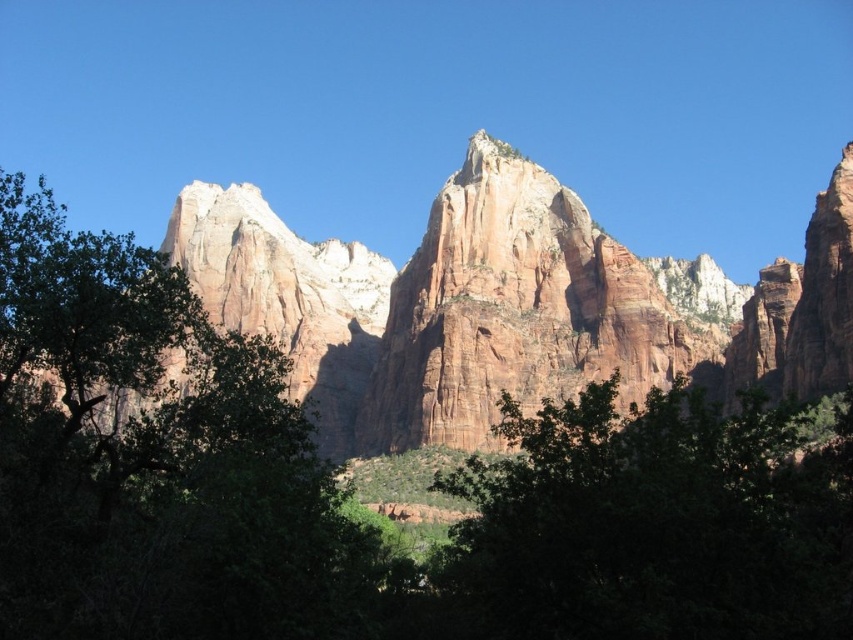
Does point (84, 413) lie behind point (520, 264)?

No, (84, 413) is closer to viewer.

The image size is (853, 640). Describe the element at coordinates (155, 458) in the screenshot. I see `green leafy tree at left` at that location.

You are a GUI agent. You are given a task and a screenshot of the screen. Output one action in this format:
    pyautogui.click(x=<x>, y=<y>)
    Task: Click on the green leafy tree at left
    The width and height of the screenshot is (853, 640).
    Given the screenshot: What is the action you would take?
    pyautogui.click(x=155, y=458)

Can you confirm if green leafy tree at left is positioned above green leafy tree at center?

Yes, green leafy tree at left is above green leafy tree at center.

Locate an element on the screen. This screenshot has width=853, height=640. green leafy tree at left is located at coordinates coord(155,458).

I want to click on green leafy tree at left, so click(x=155, y=458).

Is green leafy tree at center shorter than rustic sandstone cliff at center?

Yes, green leafy tree at center is shorter than rustic sandstone cliff at center.

Between point (512, 433) and point (579, 252), which one is positioned behind?

Positioned behind is point (579, 252).

Is point (810, 502) positioned behind point (549, 323)?

No.

Identify the location of green leafy tree at center. The image size is (853, 640). (654, 524).